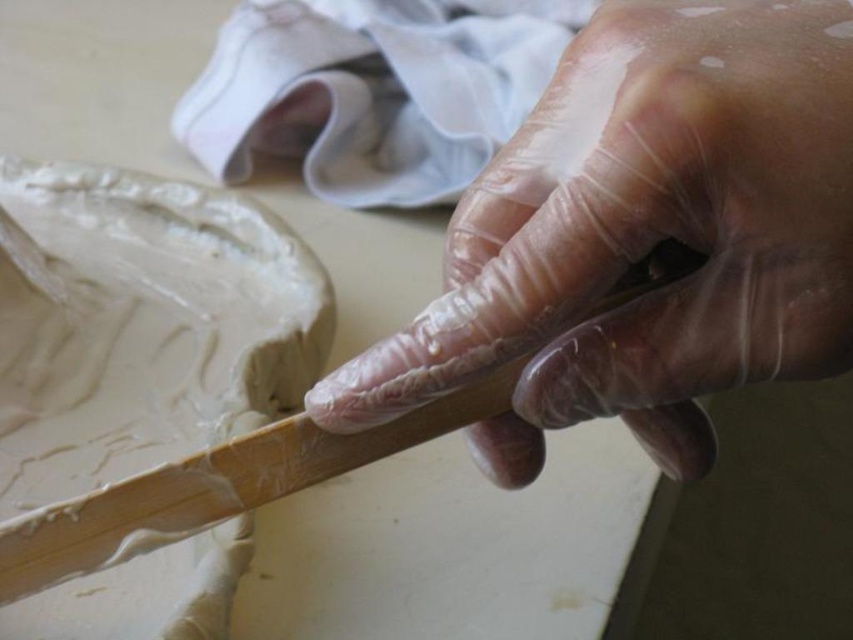
Consider the image. You are an apprentice potter observing a master craftsman. You notice the transparent plastic hand at center and the white clay at upper left. Which object is shorter in height?

The transparent plastic hand at center has a lesser height compared to the white clay at upper left, so the transparent plastic hand at center is shorter in height.

Based on the photo, you are an apprentice potter observing a master craftsman. You notice the transparent plastic hand at center and the white clay at upper left. Which object is closer to you in the scene?

The transparent plastic hand at center is closer to you because it is in front of the white clay at upper left.

You are an apprentice potter observing the image. You need to place a new tool between the transparent plastic hand at center and the white clay at upper left. Based on their positions, where should you place the tool?

The transparent plastic hand at center is to the right of the white clay at upper left, so you should place the new tool to the right of the white clay at upper left but to the left of the transparent plastic hand at center.